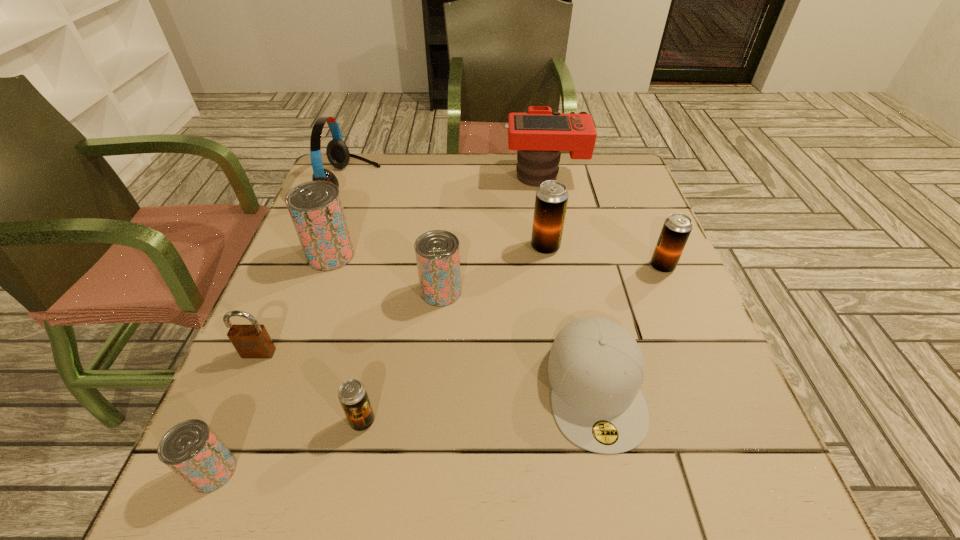
You are a GUI agent. You are given a task and a screenshot of the screen. Output one action in this format:
    pyautogui.click(x=<x>, y=<y>)
    Task: Click on the blank area in the image that satisfies the following two spatial constraints: 1. on the front-facing side of the brown padlock; 2. on the left side of the nearest beer can
    This screenshot has width=960, height=540.
    Given the screenshot: What is the action you would take?
    [x=208, y=471]

Where is `vacant region that satisfies the following two spatial constraints: 1. with the microphone attached to the side of the headset; 2. on the front-facing side of the brown padlock`? vacant region that satisfies the following two spatial constraints: 1. with the microphone attached to the side of the headset; 2. on the front-facing side of the brown padlock is located at coordinates (286, 353).